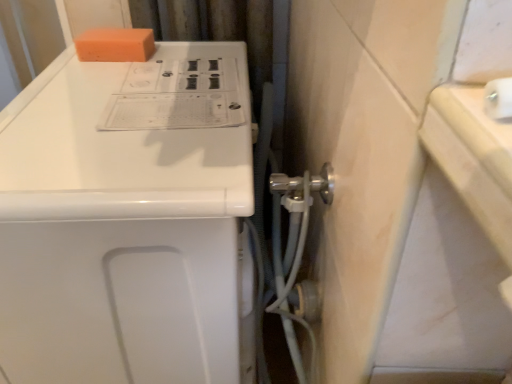
Question: From their relative heights in the image, would you say orange sponge at upper left is taller or shorter than white glossy washing machine at upper left?

Choices:
 (A) tall
 (B) short

Answer: (B)

Question: Based on their positions, is orange sponge at upper left located to the left or right of white glossy washing machine at upper left?

Choices:
 (A) left
 (B) right

Answer: (A)

Question: Choose the correct answer: Is orange sponge at upper left inside white glossy washing machine at upper left or outside it?

Choices:
 (A) outside
 (B) inside

Answer: (B)

Question: Is white glossy washing machine at upper left in front of or behind orange sponge at upper left in the image?

Choices:
 (A) behind
 (B) front

Answer: (B)

Question: Does point (86, 236) appear closer or farther from the camera than point (122, 31)?

Choices:
 (A) farther
 (B) closer

Answer: (B)

Question: In terms of height, does white glossy washing machine at upper left look taller or shorter compared to orange sponge at upper left?

Choices:
 (A) tall
 (B) short

Answer: (A)

Question: Would you say white glossy washing machine at upper left is to the left or to the right of orange sponge at upper left in the picture?

Choices:
 (A) right
 (B) left

Answer: (A)